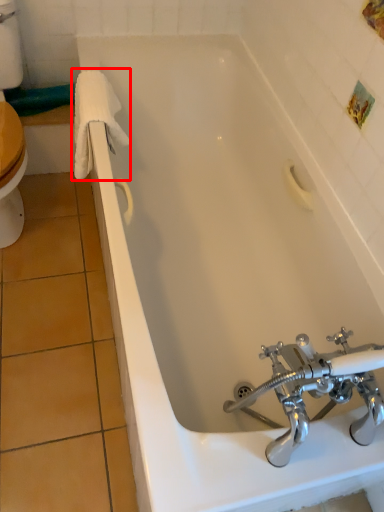
Question: From the image's perspective, what is the correct spatial relationship of bath towel (annotated by the red box) in relation to tap?

Choices:
 (A) below
 (B) above

Answer: (B)